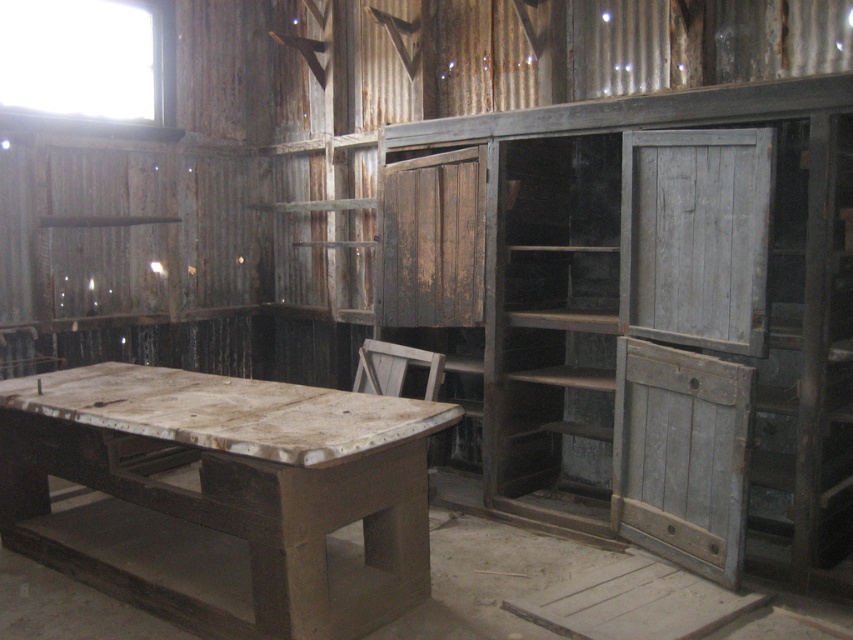
Who is lower down, rustic wood table at center or weathered gray wood at center-right?

rustic wood table at center

Based on the photo, can you confirm if rustic wood table at center is wider than weathered gray wood at center-right?

Correct, the width of rustic wood table at center exceeds that of weathered gray wood at center-right.

Is point (85, 481) more distant than point (723, 333)?

Yes, it is.

This screenshot has width=853, height=640. In order to click on rustic wood table at center in this screenshot , I will do `click(223, 496)`.

Is rustic wood table at center smaller than wooden at center?

No.

Is rustic wood table at center shorter than wooden at center?

No.

Who is more forward, (73,369) or (358,392)?

Point (358,392)

Where is `rustic wood table at center`? rustic wood table at center is located at coordinates (223, 496).

Does rustic wood table at center lie behind weathered gray wood at center?

No, rustic wood table at center is in front of weathered gray wood at center.

Who is positioned more to the right, rustic wood table at center or weathered gray wood at center?

From the viewer's perspective, weathered gray wood at center appears more on the right side.

Image resolution: width=853 pixels, height=640 pixels. What do you see at coordinates (223, 496) in the screenshot? I see `rustic wood table at center` at bounding box center [223, 496].

Locate an element on the screen. rustic wood table at center is located at coordinates (223, 496).